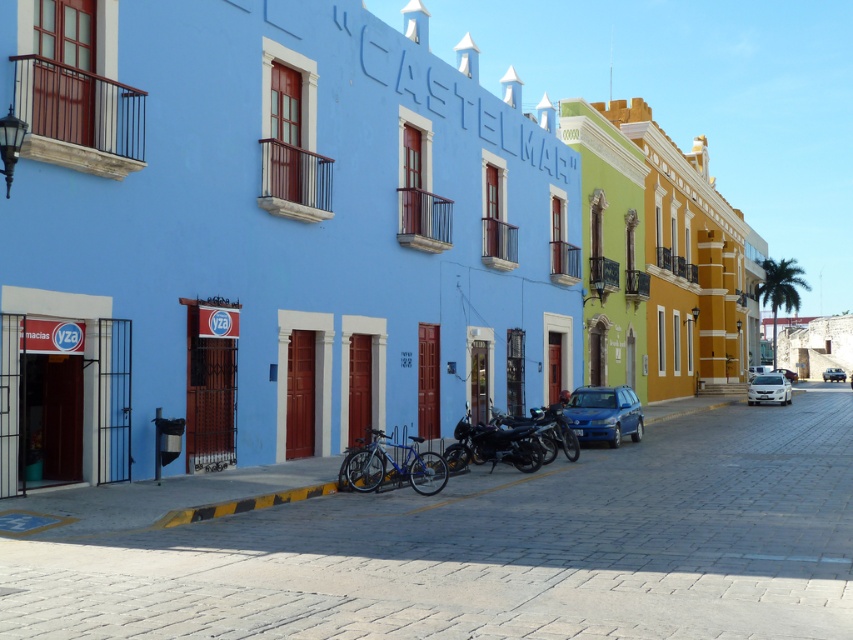
You are a delivery driver who needs to park your metallic silver car at right in a parking spot that can only accommodate vehicles smaller than the matte blue car at center. Can your car fit in the spot?

The matte blue car at center is smaller than the metallic silver car at right. Therefore, the parking spot designed for vehicles smaller than the matte blue car at center cannot accommodate the metallic silver car at right, as it is larger.

You are a delivery person needing to park your 2.5 meter wide truck between the shiny blue bicycle at center and the metallic silver car at right. Can you fit your truck in the space between them?

The distance between the shiny blue bicycle at center and the metallic silver car at right is 86.21 meters, so yes, the truck can fit between them since the space is wider than the truck.